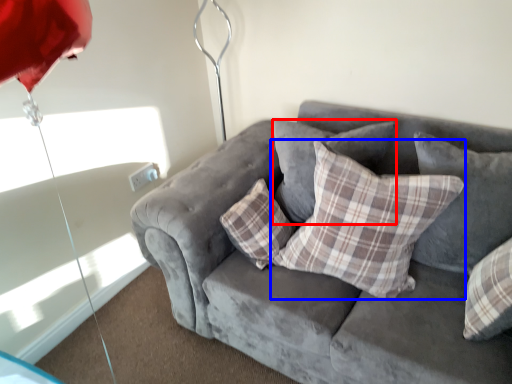
Question: Which object is closer to the camera taking this photo, pillow (highlighted by a red box) or pillow (highlighted by a blue box)?

Choices:
 (A) pillow
 (B) pillow

Answer: (B)